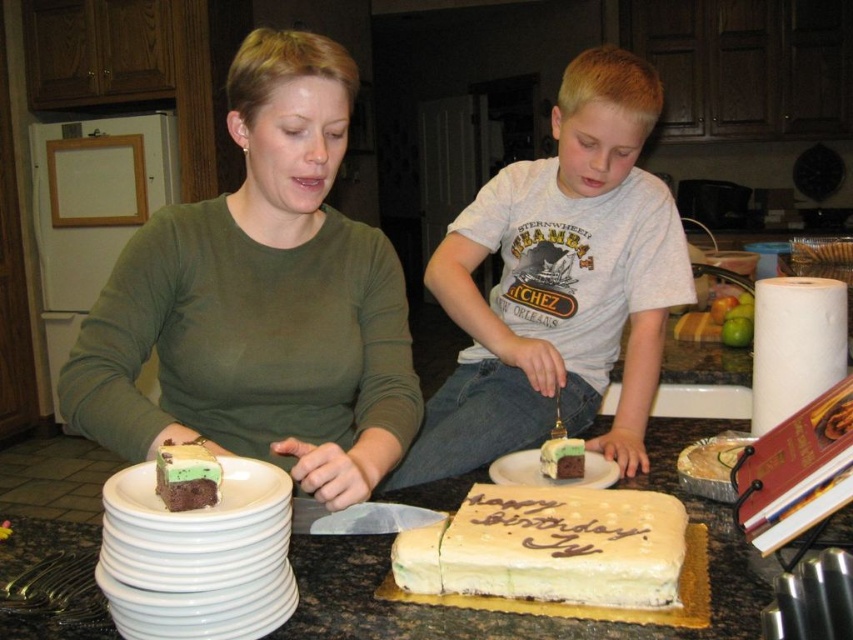
Is white frosted rectangular cake at center smaller than white ceramic plate at lower left?

Incorrect, white frosted rectangular cake at center is not smaller in size than white ceramic plate at lower left.

Looking at this image, between white frosted rectangular cake at center and white ceramic plate at lower left, which one has more height?

Standing taller between the two is white ceramic plate at lower left.

Which is in front, point (643, 568) or point (219, 604)?

Positioned in front is point (219, 604).

Identify the location of white frosted rectangular cake at center. The height and width of the screenshot is (640, 853). (550, 547).

Is chocolatesmoothcake at center below white ceramic plate at center?

Incorrect, chocolatesmoothcake at center is not positioned below white ceramic plate at center.

The image size is (853, 640). Identify the location of chocolatesmoothcake at center. pos(186,476).

The height and width of the screenshot is (640, 853). In order to click on chocolatesmoothcake at center in this screenshot , I will do `click(186, 476)`.

Who is positioned more to the right, matte green shirt at center or green frosted cake at center?

green frosted cake at center

Measure the distance between matte green shirt at center and camera.

matte green shirt at center and camera are 34.87 inches apart from each other.

What do you see at coordinates (260, 300) in the screenshot?
I see `matte green shirt at center` at bounding box center [260, 300].

You are a GUI agent. You are given a task and a screenshot of the screen. Output one action in this format:
    pyautogui.click(x=<x>, y=<y>)
    Task: Click on the matte green shirt at center
    
    Given the screenshot: What is the action you would take?
    pyautogui.click(x=260, y=300)